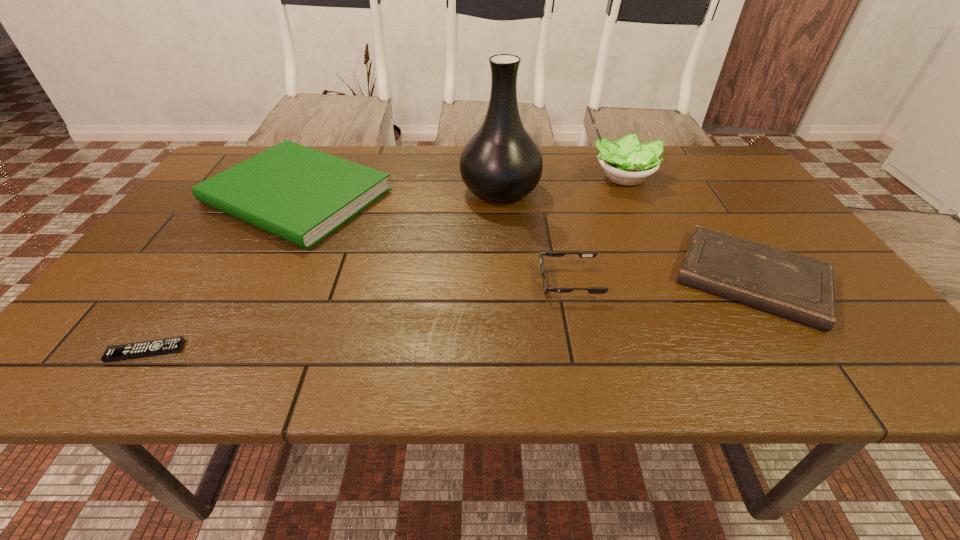
The height and width of the screenshot is (540, 960). I want to click on object that is at the near edge, so [x=165, y=346].

Image resolution: width=960 pixels, height=540 pixels. What are the coordinates of `paperback book located in the left edge section of the desktop` in the screenshot? It's located at (299, 194).

Where is `remote control located in the left edge section of the desktop`? remote control located in the left edge section of the desktop is located at coordinates (165, 346).

Where is `object that is at the right edge`? This screenshot has width=960, height=540. object that is at the right edge is located at coordinates (801, 288).

You are a GUI agent. You are given a task and a screenshot of the screen. Output one action in this format:
    pyautogui.click(x=<x>, y=<y>)
    Task: Click on the object present at the far left corner
    
    Given the screenshot: What is the action you would take?
    pyautogui.click(x=299, y=194)

You are a GUI agent. You are given a task and a screenshot of the screen. Output one action in this format:
    pyautogui.click(x=<x>, y=<y>)
    Task: Click on the object at the near left corner
    
    Given the screenshot: What is the action you would take?
    pyautogui.click(x=165, y=346)

At what (x,y) coordinates should I click in order to perform the action: click on vacant region at the far edge of the desktop. Please return your answer as a coordinate pair (x, y). Looking at the image, I should click on (452, 180).

The width and height of the screenshot is (960, 540). I want to click on vacant point at the near edge, so click(316, 349).

Image resolution: width=960 pixels, height=540 pixels. In the image, there is a desktop. Find the location of `vacant space at the right edge`. vacant space at the right edge is located at coordinates (842, 292).

The image size is (960, 540). In the image, there is a desktop. Find the location of `vacant space at the near left corner`. vacant space at the near left corner is located at coordinates (100, 381).